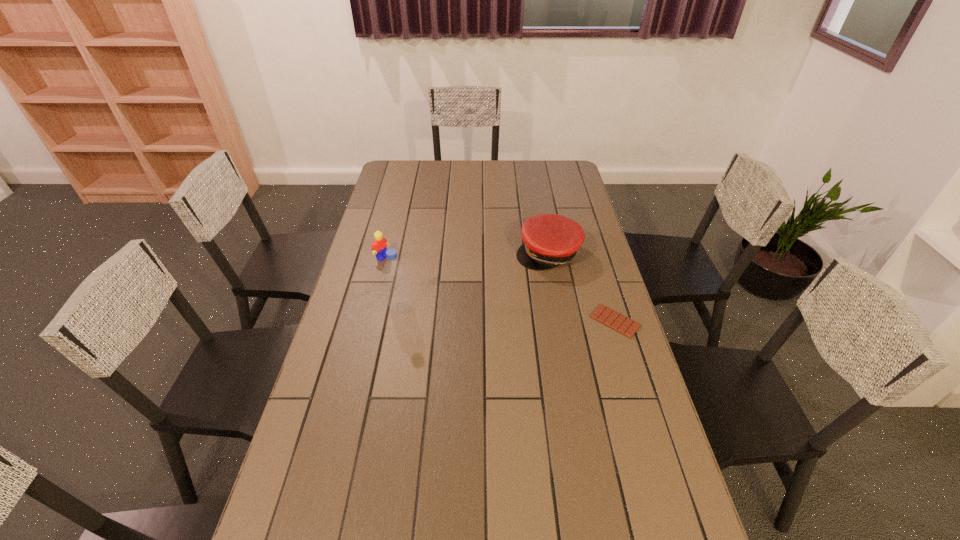
Where is `the tallest object`? Image resolution: width=960 pixels, height=540 pixels. the tallest object is located at coordinates (397, 289).

The width and height of the screenshot is (960, 540). I want to click on the third object from right to left, so coord(397,289).

Identify the location of the shortest object. (603, 314).

Find the location of `cap`. cap is located at coordinates (550, 240).

Locate an element on the screen. Image resolution: width=960 pixels, height=540 pixels. the leftmost object is located at coordinates (379, 245).

You are a GUI agent. You are given a task and a screenshot of the screen. Output one action in this format:
    pyautogui.click(x=<x>, y=<y>)
    Task: Click on the vacant area situated 0.050m on the right of the second object from left to right
    Image resolution: width=960 pixels, height=540 pixels.
    Given the screenshot: What is the action you would take?
    pyautogui.click(x=427, y=308)

Where is `vacant space located on the front of the shortest object`? vacant space located on the front of the shortest object is located at coordinates (660, 468).

This screenshot has height=540, width=960. I want to click on free location located 0.080m at the front of the cap where the visor is located, so click(x=539, y=288).

The width and height of the screenshot is (960, 540). What are the coordinates of `vacant space located at the front of the cap where the visor is located` in the screenshot? It's located at (526, 337).

You are a GUI agent. You are given a task and a screenshot of the screen. Output one action in this format:
    pyautogui.click(x=<x>, y=<y>)
    Task: Click on the free spot located at the front of the cap where the visor is located
    This screenshot has width=960, height=540.
    Given the screenshot: What is the action you would take?
    click(x=525, y=340)